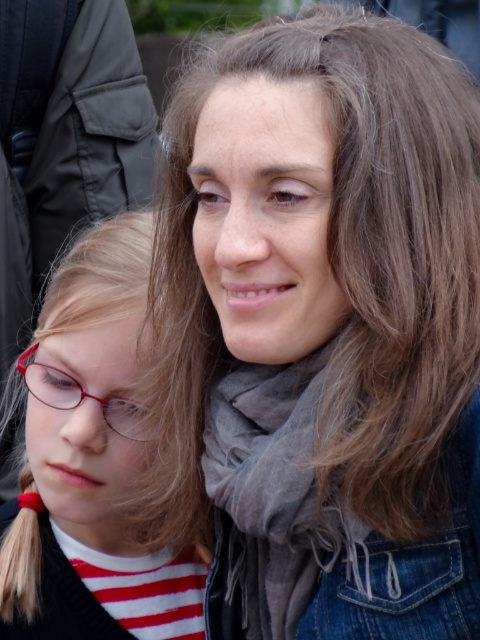
Can you confirm if brown matte hair at upper center is bigger than gray soft scarf at center?

Yes.

Which is in front, point (416, 268) or point (287, 572)?

Point (416, 268) is in front.

Describe the element at coordinates (338, 272) in the screenshot. I see `brown matte hair at upper center` at that location.

Identify the location of brown matte hair at upper center. Image resolution: width=480 pixels, height=640 pixels. (338, 272).

Does brown matte hair at upper center appear on the right side of matte red glasses at lower left?

Correct, you'll find brown matte hair at upper center to the right of matte red glasses at lower left.

Does point (396, 472) come behind point (121, 420)?

No, it is not.

Locate an element on the screen. brown matte hair at upper center is located at coordinates (338, 272).

Is matte red glasses at left positioned before gray soft scarf at center?

No, it is not.

What do you see at coordinates (90, 461) in the screenshot? The width and height of the screenshot is (480, 640). I see `matte red glasses at left` at bounding box center [90, 461].

Is point (139, 474) more distant than point (303, 470)?

That is True.

The width and height of the screenshot is (480, 640). Find the location of `matte red glasses at left`. matte red glasses at left is located at coordinates tap(90, 461).